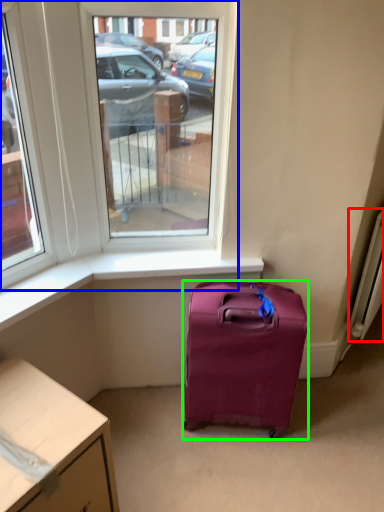
Question: Which object is the farthest from radiator (highlighted by a red box)? Choose among these: window (highlighted by a blue box) or luggage and bags (highlighted by a green box).

Choices:
 (A) window
 (B) luggage and bags

Answer: (A)